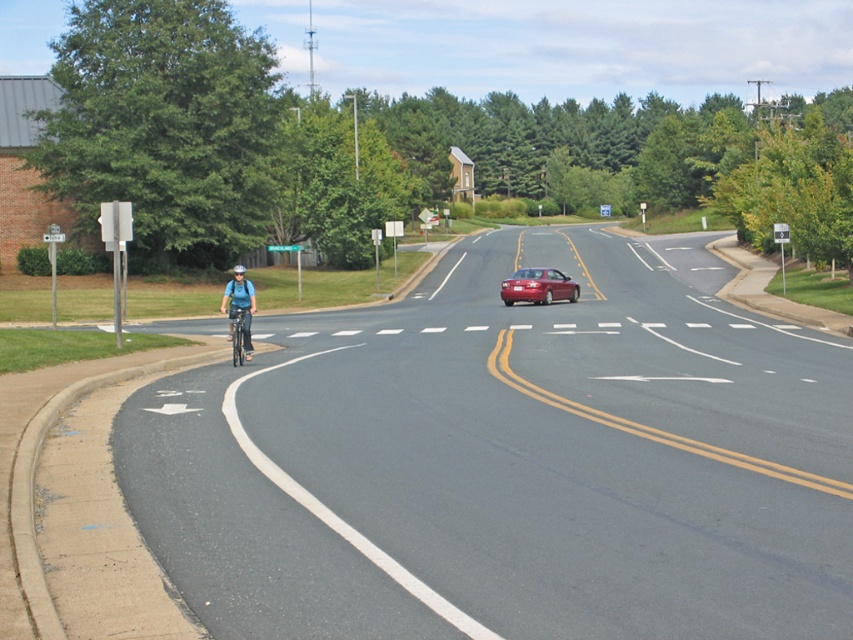
You are a drone operator trying to capture aerial footage of the suburban road intersection. You need to ensure that your drone stays above the legal altitude limit of 400 feet. If the point of interest is at coordinates point (492,586), which is 21.50 feet away from the camera, what is the minimum safe altitude your drone should maintain to comply with regulations?

The point (492,586) is 21.50 feet away from the camera. To comply with the 400 feet altitude limit, the drone should maintain a minimum safe altitude of 400 feet, as this is above the required legal limit and ensures compliance.

You are a delivery driver planning to make a right turn onto the suburban road. You see the black asphalt bike lane at left and the matte blue helmet at center. Which object is bigger in the image?

The black asphalt bike lane at left is larger in size compared to the matte blue helmet at center.